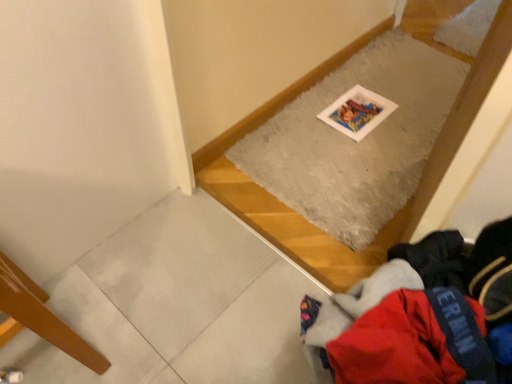
Question: Is red fleece jacket at lower right taller than wooden floorboard at lower left?

Choices:
 (A) no
 (B) yes

Answer: (A)

Question: Is red fleece jacket at lower right shorter than wooden floorboard at lower left?

Choices:
 (A) no
 (B) yes

Answer: (B)

Question: Is red fleece jacket at lower right touching wooden floorboard at lower left?

Choices:
 (A) no
 (B) yes

Answer: (A)

Question: Is red fleece jacket at lower right oriented away from wooden floorboard at lower left?

Choices:
 (A) no
 (B) yes

Answer: (A)

Question: Does red fleece jacket at lower right appear on the right side of wooden floorboard at lower left?

Choices:
 (A) yes
 (B) no

Answer: (A)

Question: Do you think red fleece jacket at lower right is within gray fluffy mat at upper center, or outside of it?

Choices:
 (A) outside
 (B) inside

Answer: (A)

Question: Relative to gray fluffy mat at upper center, is red fleece jacket at lower right in front or behind?

Choices:
 (A) front
 (B) behind

Answer: (A)

Question: Based on their positions, is red fleece jacket at lower right located to the left or right of gray fluffy mat at upper center?

Choices:
 (A) right
 (B) left

Answer: (B)

Question: Is point (404, 332) positioned closer to the camera than point (396, 173)?

Choices:
 (A) farther
 (B) closer

Answer: (B)

Question: In the image, is gray fluffy mat at upper center on the left side or the right side of red fleece jacket at lower right?

Choices:
 (A) left
 (B) right

Answer: (B)

Question: Considering the positions of point (357, 240) and point (465, 370), is point (357, 240) closer or farther from the camera than point (465, 370)?

Choices:
 (A) farther
 (B) closer

Answer: (A)

Question: Is gray fluffy mat at upper center wider or thinner than red fleece jacket at lower right?

Choices:
 (A) thin
 (B) wide

Answer: (B)

Question: From the image's perspective, is gray fluffy mat at upper center located above or below red fleece jacket at lower right?

Choices:
 (A) below
 (B) above

Answer: (B)

Question: Considering the positions of gray fluffy mat at upper center and wooden floorboard at lower left in the image, is gray fluffy mat at upper center bigger or smaller than wooden floorboard at lower left?

Choices:
 (A) small
 (B) big

Answer: (A)

Question: Considering the relative positions of gray fluffy mat at upper center and wooden floorboard at lower left in the image provided, is gray fluffy mat at upper center to the left or to the right of wooden floorboard at lower left?

Choices:
 (A) left
 (B) right

Answer: (B)